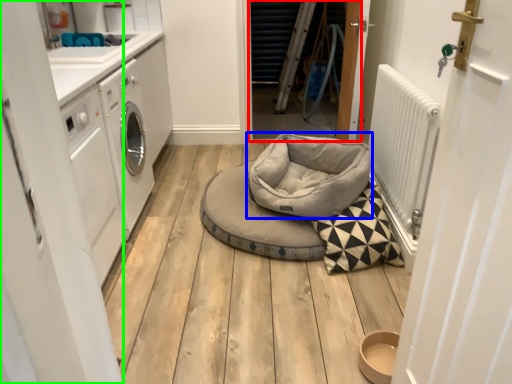
Question: Estimate the real-world distances between objects in this image. Which object is closer to door (highlighted by a red box), dog bed (highlighted by a blue box) or door (highlighted by a green box)?

Choices:
 (A) dog bed
 (B) door

Answer: (A)